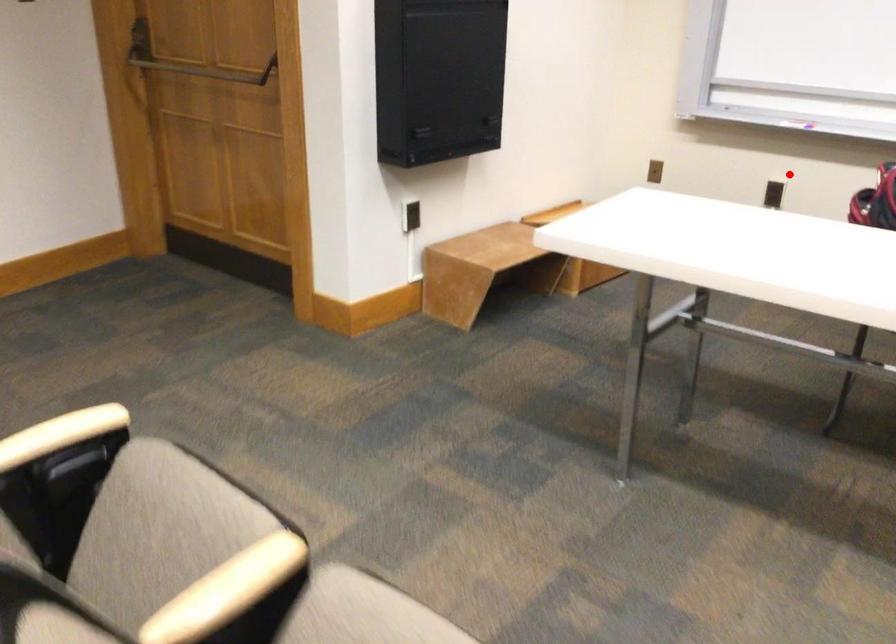
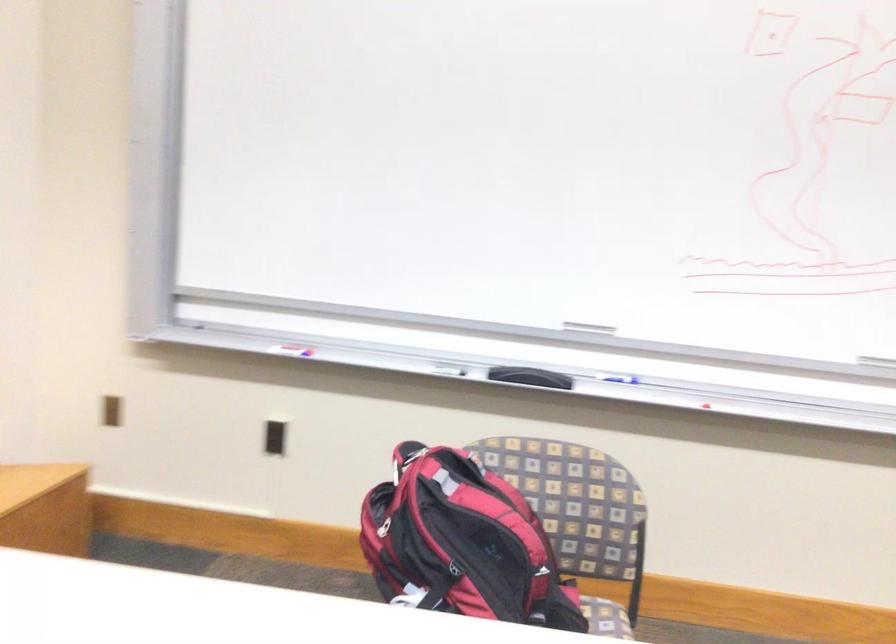
Find the pixel in the second image that matches the highlighted location in the first image.

(273, 438)